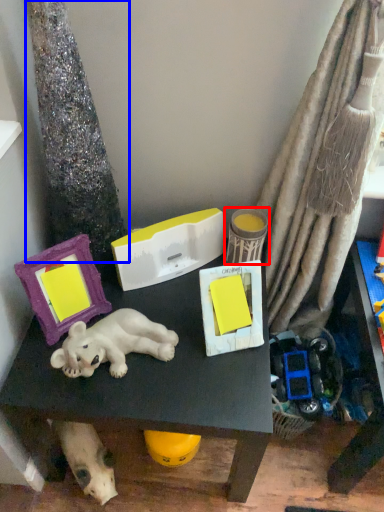
Question: Which object appears farthest to the camera in this image, toy (highlighted by a red box) or tree trunk (highlighted by a blue box)?

Choices:
 (A) toy
 (B) tree trunk

Answer: (A)